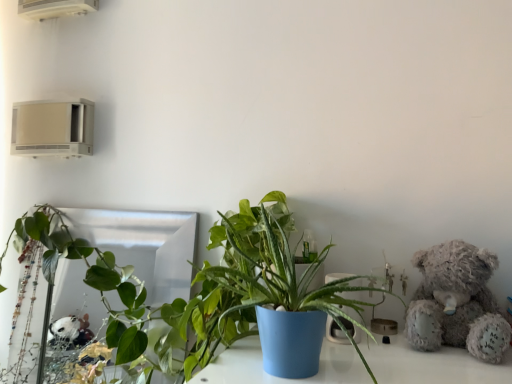
Question: From a real-world perspective, is white plastic air conditioner at upper left, which ranks as the 1th air conditioning in top-to-bottom order, positioned above or below beige plastic air conditioner at upper left, the second air conditioning viewed from the top?

Choices:
 (A) below
 (B) above

Answer: (B)

Question: From the image's perspective, relative to beige plastic air conditioner at upper left, which is the 1th air conditioning in bottom-to-top order, is white plastic air conditioner at upper left, marked as the 2th air conditioning in a bottom-to-top arrangement, above or below?

Choices:
 (A) above
 (B) below

Answer: (A)

Question: Which of these objects is positioned farthest from the green glossy plant at left, which appears as the 2th houseplant when viewed from the front?

Choices:
 (A) green leafy plant at center, acting as the 2th houseplant starting from the back
 (B) fluffy gray teddy bear at right
 (C) beige plastic air conditioner at upper left, which is the 1th air conditioning in bottom-to-top order
 (D) white plastic air conditioner at upper left, marked as the 2th air conditioning in a bottom-to-top arrangement

Answer: (D)

Question: Which object is positioned farthest from the white plastic air conditioner at upper left, marked as the 2th air conditioning in a bottom-to-top arrangement?

Choices:
 (A) green glossy plant at left, which is counted as the first houseplant, starting from the back
 (B) fluffy gray teddy bear at right
 (C) beige plastic air conditioner at upper left, which is the 1th air conditioning in bottom-to-top order
 (D) green leafy plant at center, placed as the second houseplant when sorted from left to right

Answer: (B)